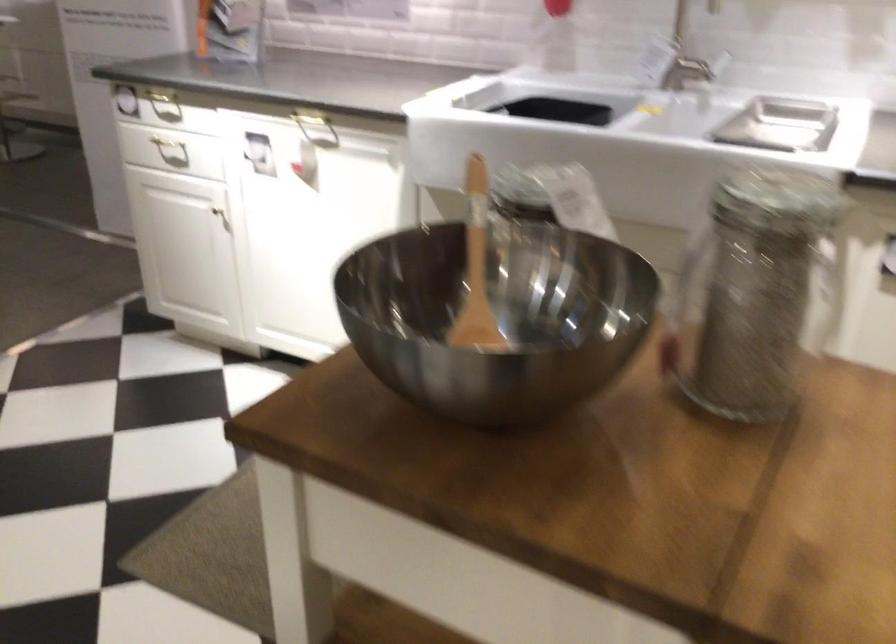
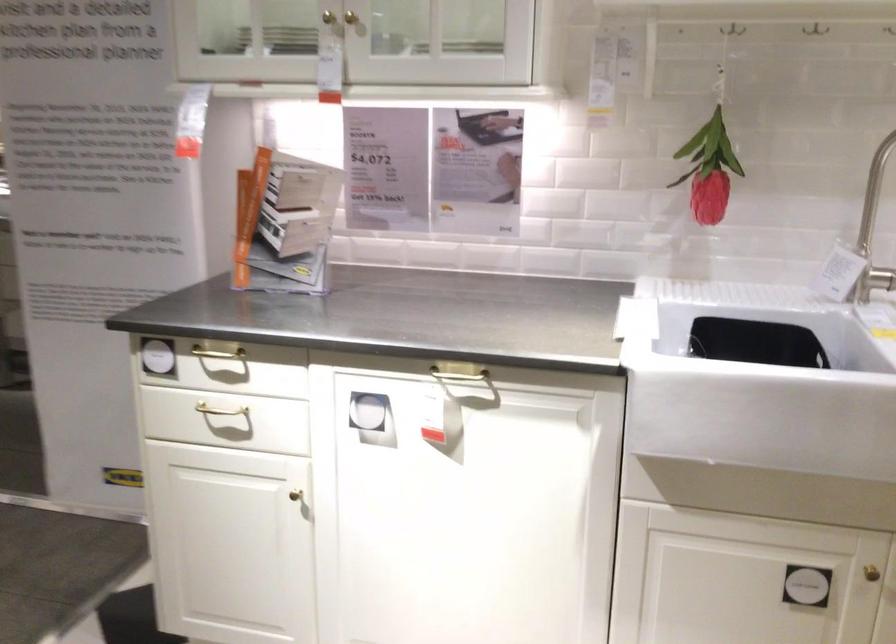
Question: Based on the continuous images, in which direction is the camera rotating? Reply with the corresponding letter.

Choices:
 (A) Left
 (B) Right
 (C) Up
 (D) Down

Answer: (C)